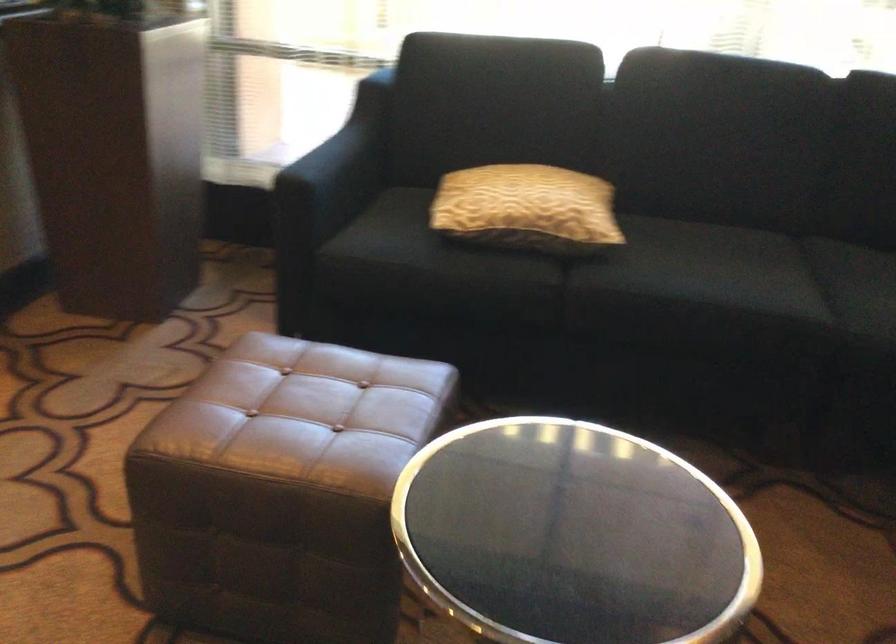
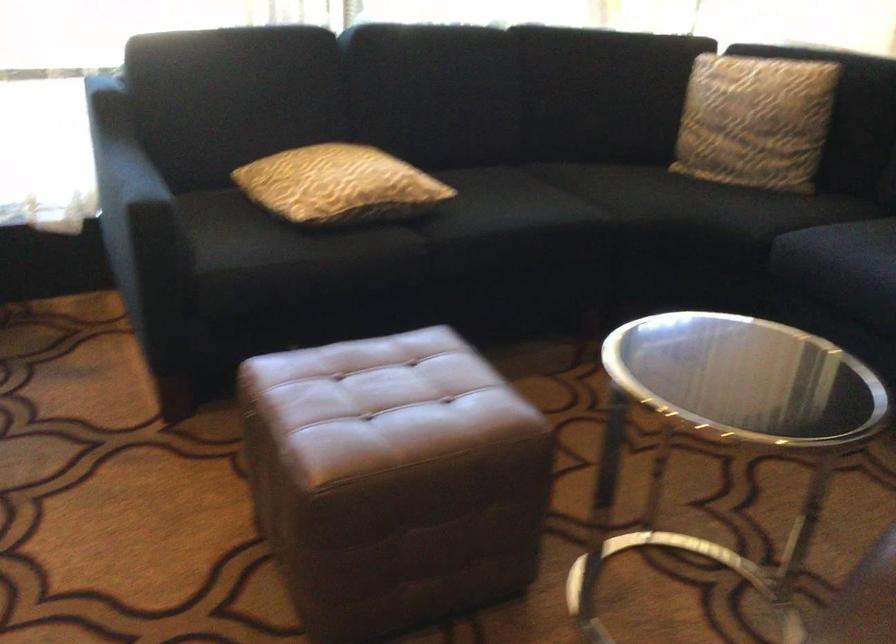
The point at (214, 478) is marked in the first image. Where is the corresponding point in the second image?

(392, 480)